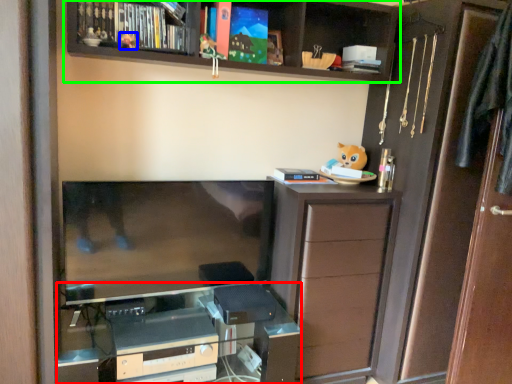
Question: Which is farther away from computer desk (highlighted by a red box)? toy (highlighted by a blue box) or shelf (highlighted by a green box)?

Choices:
 (A) toy
 (B) shelf

Answer: (A)